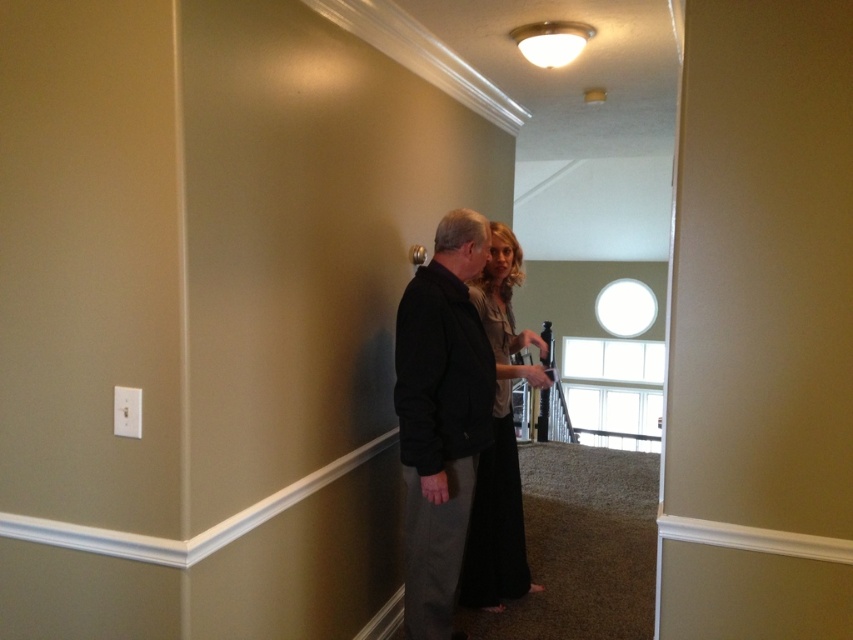
Can you confirm if black matte jacket at center is thinner than black silk dress at center?

Indeed, black matte jacket at center has a lesser width compared to black silk dress at center.

Is black matte jacket at center closer to the viewer compared to black silk dress at center?

Yes, black matte jacket at center is closer to the viewer.

Is point (450, 378) positioned in front of point (482, 564)?

Yes.

Locate an element on the screen. Image resolution: width=853 pixels, height=640 pixels. black matte jacket at center is located at coordinates (440, 417).